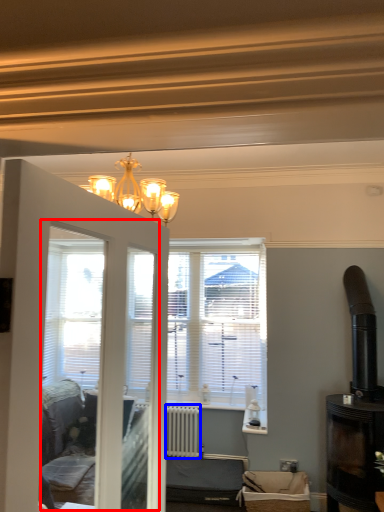
Question: Which of the following is the closest to the observer, screen door (highlighted by a red box) or radiator (highlighted by a blue box)?

Choices:
 (A) screen door
 (B) radiator

Answer: (A)